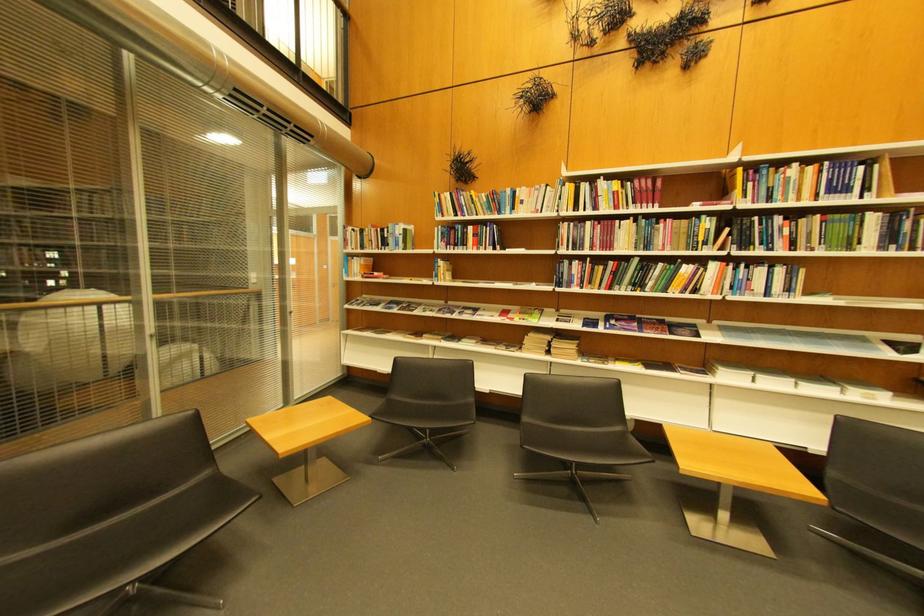
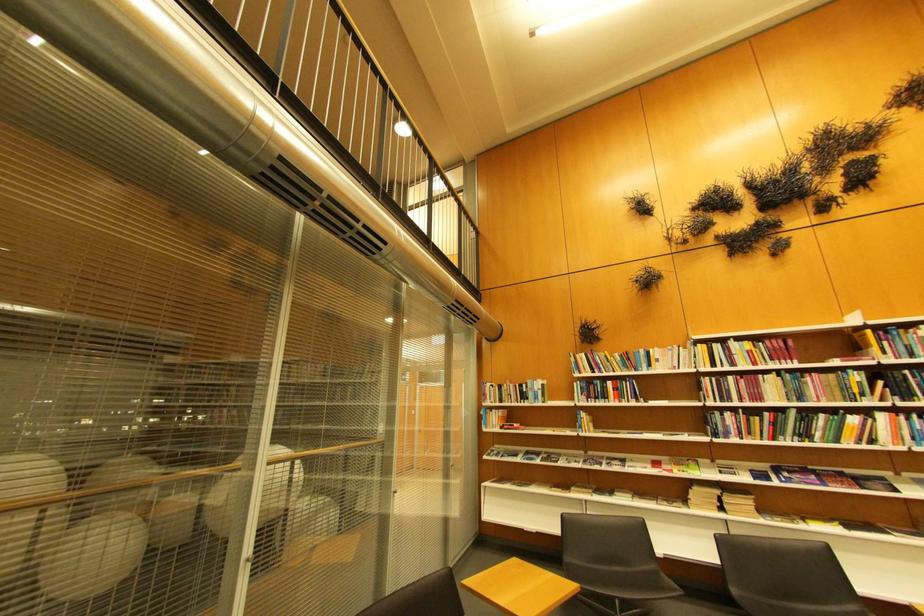
Locate, in the second image, the point that corresponds to (600,225) in the first image.

(740, 379)